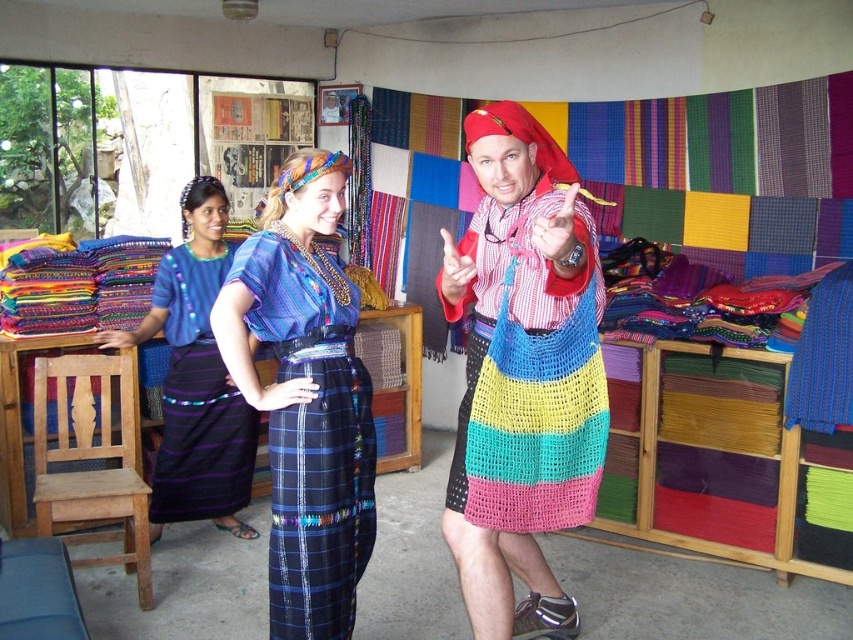
You are a customer in the textile shop and want to touch both points you see on the fabric display. Which point, point (547, 289) or point (218, 380), is closer to you?

Point (547, 289) is closer to you than point (218, 380).

You are a customer in the textile shop and want to try on the matte blue fabric dress at center. The fitting room is located 2 meters away from where you are standing. Can you reach the fitting room before the dress is moved by the shop assistant?

The distance between you and the matte blue fabric dress at center is 2.10 meters. Since the fitting room is only 2 meters away, you cannot reach it before the dress is moved because you are slightly farther than the required distance.

From the picture: You are a customer in the textile shop and want to buy both the multicolored knitted bag at center and the blue plaid skirt at center. However, you have a limited budget. If the price of each item is proportional to its height, which item should you choose to buy if you want the taller one?

The blue plaid skirt at center is taller than the multicolored knitted bag at center, so you should choose to buy the blue plaid skirt at center if you want the taller one.